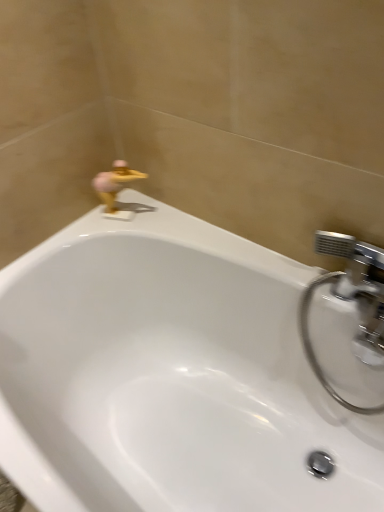
Question: Is white glossy bathtub at upper center positioned far away from gold metallic duck at upper left?

Choices:
 (A) yes
 (B) no

Answer: (B)

Question: Is white glossy bathtub at upper center oriented towards gold metallic duck at upper left?

Choices:
 (A) no
 (B) yes

Answer: (A)

Question: Is white glossy bathtub at upper center outside of gold metallic duck at upper left?

Choices:
 (A) no
 (B) yes

Answer: (B)

Question: Does white glossy bathtub at upper center lie in front of gold metallic duck at upper left?

Choices:
 (A) no
 (B) yes

Answer: (B)

Question: Is white glossy bathtub at upper center next to gold metallic duck at upper left?

Choices:
 (A) yes
 (B) no

Answer: (B)

Question: Does white glossy bathtub at upper center have a larger size compared to gold metallic duck at upper left?

Choices:
 (A) no
 (B) yes

Answer: (B)

Question: Is white glossy bathtub at upper center a part of chrome metallic faucet at upper right?

Choices:
 (A) no
 (B) yes

Answer: (A)

Question: From the image's perspective, would you say chrome metallic faucet at upper right is shown under white glossy bathtub at upper center?

Choices:
 (A) no
 (B) yes

Answer: (A)

Question: From the image's perspective, is chrome metallic faucet at upper right over white glossy bathtub at upper center?

Choices:
 (A) yes
 (B) no

Answer: (A)

Question: Is the depth of chrome metallic faucet at upper right less than that of white glossy bathtub at upper center?

Choices:
 (A) yes
 (B) no

Answer: (B)

Question: Is chrome metallic faucet at upper right thinner than white glossy bathtub at upper center?

Choices:
 (A) yes
 (B) no

Answer: (A)

Question: Is chrome metallic faucet at upper right positioned with its back to white glossy bathtub at upper center?

Choices:
 (A) no
 (B) yes

Answer: (B)

Question: Is chrome metallic faucet at upper right turned away from gold metallic duck at upper left?

Choices:
 (A) yes
 (B) no

Answer: (B)